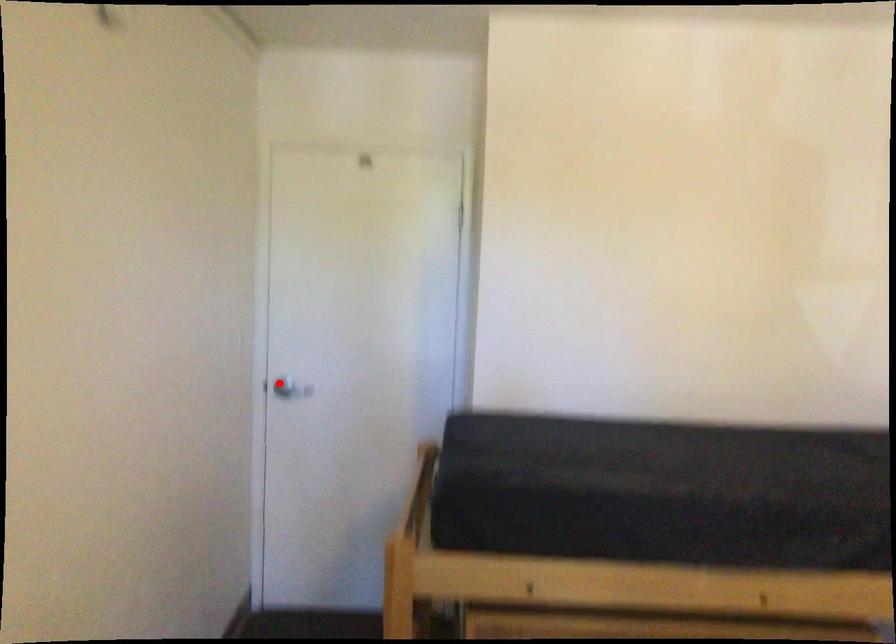
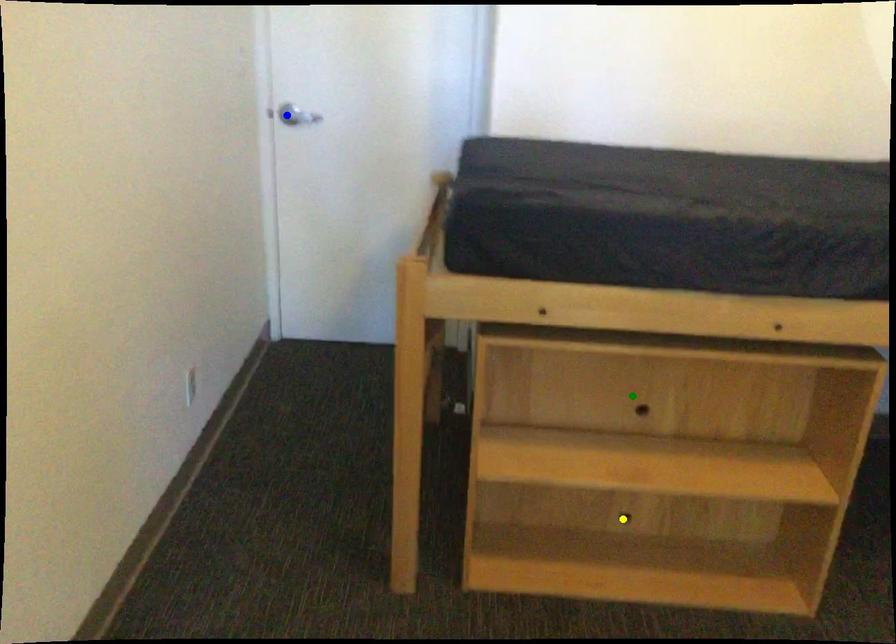
Question: I am providing you with two images of the same scene from different viewpoints. A red point is marked on the first image. You are given multiple points on the second image. Which mark in image 2 goes with the point in image 1?

Choices:
 (A) blue point
 (B) yellow point
 (C) green point

Answer: (A)